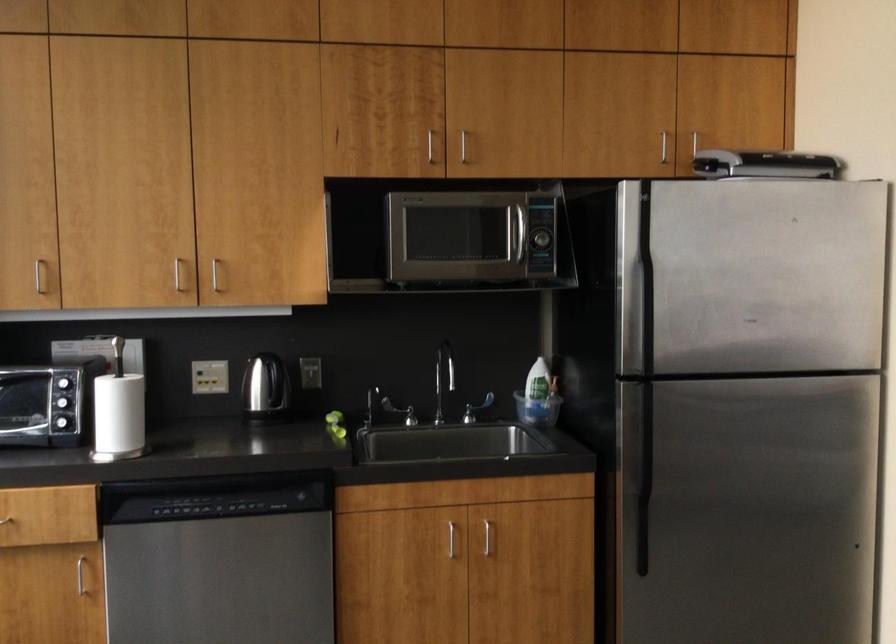
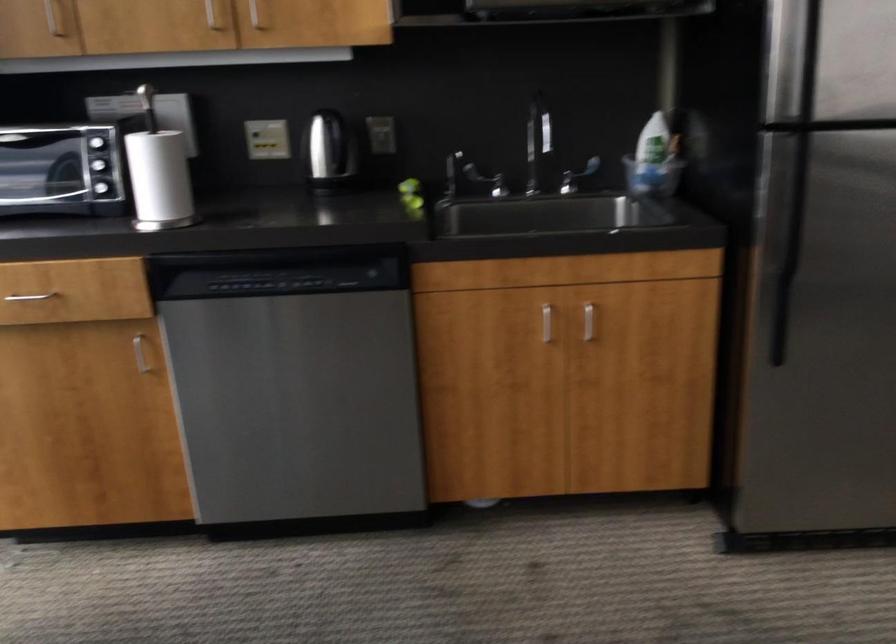
Where in the second image is the point corresponding to point 453,540 from the first image?

(546, 323)